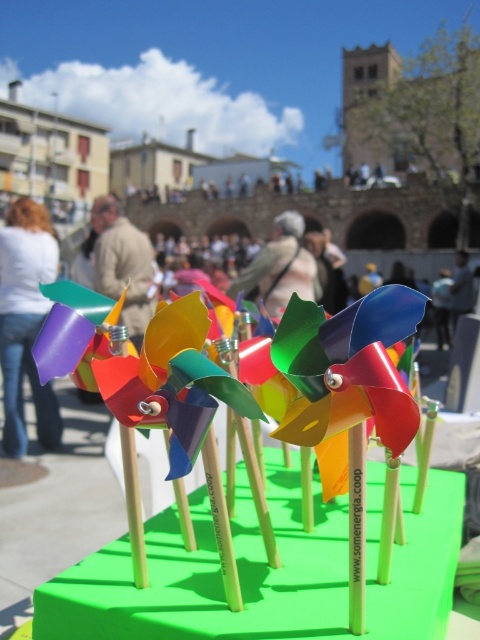
Question: Which object is the closest to the green matte table at center?

Choices:
 (A) light brown leather jacket at center
 (B) light beige fabric at center

Answer: (A)

Question: Is the position of light brown leather jacket at center less distant than that of light beige fabric at center?

Choices:
 (A) no
 (B) yes

Answer: (B)

Question: Estimate the real-world distances between objects in this image. Which object is closer to the green matte table at center?

Choices:
 (A) matte purple tie at left
 (B) light beige fabric at center
 (C) light brown leather jacket at center

Answer: (A)

Question: Can you confirm if matte purple tie at left is positioned above light beige fabric at center?

Choices:
 (A) yes
 (B) no

Answer: (B)

Question: Among these objects, which one is nearest to the camera?

Choices:
 (A) light brown leather jacket at center
 (B) light beige fabric at center
 (C) matte purple tie at left

Answer: (C)

Question: Can you confirm if matte purple tie at left is smaller than light beige fabric at center?

Choices:
 (A) yes
 (B) no

Answer: (A)